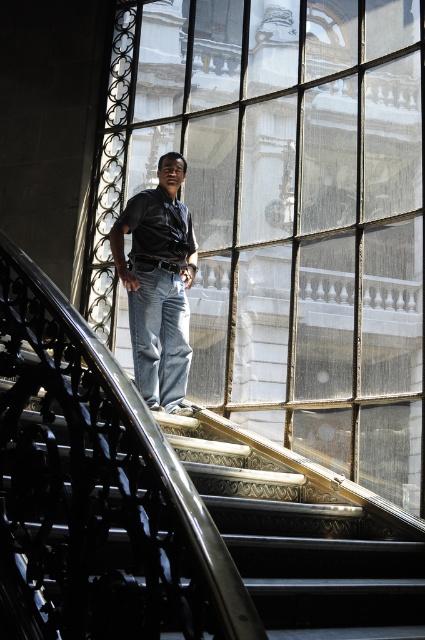
Question: Where is clear glass window at center located in relation to matte black shirt at center in the image?

Choices:
 (A) above
 (B) below

Answer: (A)

Question: In this image, where is clear glass window at center located relative to matte black shirt at center?

Choices:
 (A) left
 (B) right

Answer: (B)

Question: Which point is closer to the camera?

Choices:
 (A) clear glass window at center
 (B) matte black shirt at center

Answer: (A)

Question: Can you confirm if clear glass window at center is bigger than matte black shirt at center?

Choices:
 (A) yes
 (B) no

Answer: (A)